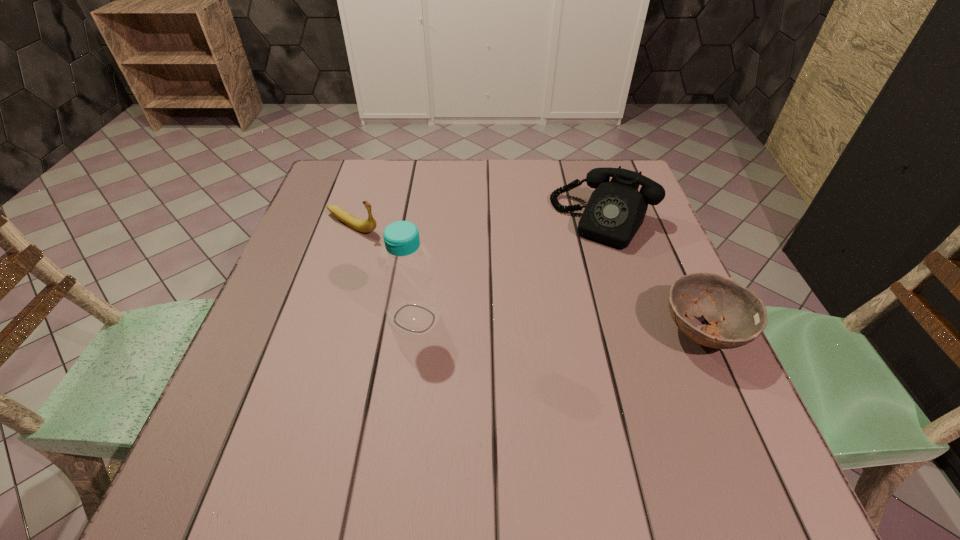
At what (x,y) coordinates should I click in order to perform the action: click on vacant spot on the desktop that is between the tallest object and the bowl and is positioned at the stem of the leftmost object. Please return your answer as a coordinate pair (x, y). Looking at the image, I should click on (545, 325).

Locate an element on the screen. This screenshot has height=540, width=960. free spot on the desktop that is between the second object from left to right and the shortest object and is positioned on the dial of the telephone is located at coordinates pos(544,325).